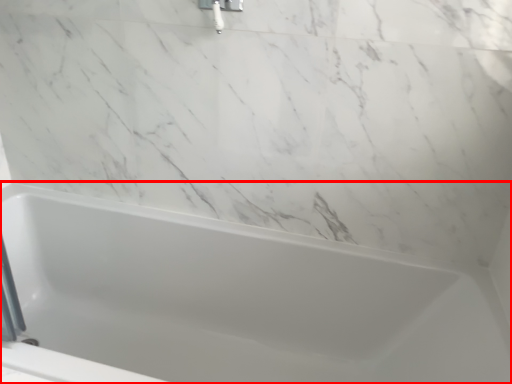
Question: From the image's perspective, considering the relative positions of bathtub (annotated by the red box) and shower in the image provided, where is bathtub (annotated by the red box) located with respect to the staircase?

Choices:
 (A) below
 (B) above

Answer: (A)